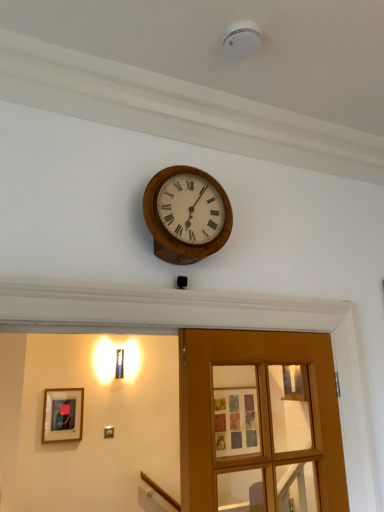
Locate an element on the screen. This screenshot has height=512, width=384. wooden wall clock at upper center is located at coordinates (186, 214).

What are the coordinates of `wooden glass door at center` in the screenshot? It's located at (258, 410).

Looking at this image, considering the relative positions of wooden framed picture at lower left and wooden wall clock at upper center in the image provided, is wooden framed picture at lower left to the left of wooden wall clock at upper center from the viewer's perspective?

Yes.

From a real-world perspective, which is physically above, wooden framed picture at lower left or wooden wall clock at upper center?

wooden wall clock at upper center, from a real-world perspective.

Is wooden framed picture at lower left in contact with wooden wall clock at upper center?

No, wooden framed picture at lower left is not beside wooden wall clock at upper center.

How many degrees apart are the facing directions of wooden framed picture at lower left and wooden wall clock at upper center?

The angular difference between wooden framed picture at lower left and wooden wall clock at upper center is 2.02 degrees.

Does point (218, 215) come closer to viewer compared to point (273, 490)?

No, it is behind (273, 490).

Identify the location of door located on the right of wooden wall clock at upper center. Image resolution: width=384 pixels, height=512 pixels. (258, 410).

From a real-world perspective, which is physically above, wooden wall clock at upper center or wooden glass door at center?

wooden wall clock at upper center is physically above.

Is wooden glass door at center smaller than wooden wall clock at upper center?

No.

Is wooden glass door at center inside or outside of wooden wall clock at upper center?

wooden glass door at center is outside wooden wall clock at upper center.

Is wooden glass door at center positioned with its back to wooden wall clock at upper center?

That's not correct — wooden glass door at center is not looking away from wooden wall clock at upper center.

Between wooden glass door at center and wooden wall clock at upper center, which one has smaller width?

wooden wall clock at upper center.

Is wooden wall clock at upper center positioned far away from wooden framed picture at lower left?

Yes, wooden wall clock at upper center is far from wooden framed picture at lower left.

Considering the relative sizes of wooden wall clock at upper center and wooden framed picture at lower left in the image provided, is wooden wall clock at upper center bigger than wooden framed picture at lower left?

Yes, wooden wall clock at upper center is bigger than wooden framed picture at lower left.

This screenshot has height=512, width=384. I want to click on picture frame located below the wooden wall clock at upper center (from the image's perspective), so click(x=62, y=415).

Considering the relative sizes of wooden wall clock at upper center and wooden framed picture at lower left in the image provided, is wooden wall clock at upper center thinner than wooden framed picture at lower left?

Answer: Incorrect, the width of wooden wall clock at upper center is not less than that of wooden framed picture at lower left.

Does point (313, 429) come behind point (58, 411)?

No, (313, 429) is closer to viewer.

In the scene shown: From a real-world perspective, is wooden glass door at center beneath wooden framed picture at lower left?

No, from a real-world perspective, wooden glass door at center is not beneath wooden framed picture at lower left.

Looking at their sizes, would you say wooden framed picture at lower left is wider or thinner than wooden glass door at center?

Considering their sizes, wooden framed picture at lower left looks slimmer than wooden glass door at center.

From a real-world perspective, which object rests below the other?

From a 3D spatial view, wooden framed picture at lower left is below.

Is wooden framed picture at lower left positioned beyond the bounds of wooden glass door at center?

Yes.

Is wooden framed picture at lower left in front of wooden glass door at center?

No.

The image size is (384, 512). Identify the location of wall clock that is above the wooden framed picture at lower left (from the image's perspective). (186, 214).

Image resolution: width=384 pixels, height=512 pixels. Find the location of `wall clock that is above the wooden glass door at center (from a real-world perspective)`. wall clock that is above the wooden glass door at center (from a real-world perspective) is located at coordinates (186, 214).

In the scene shown: Considering their positions, is wooden glass door at center positioned further to wooden wall clock at upper center than wooden framed picture at lower left?

wooden framed picture at lower left is further to wooden wall clock at upper center.

When comparing their distances from wooden framed picture at lower left, does wooden glass door at center or wooden wall clock at upper center seem closer?

wooden glass door at center.

Looking at the image, which one is located closer to wooden glass door at center, wooden framed picture at lower left or wooden wall clock at upper center?

wooden wall clock at upper center is positioned closer to the anchor wooden glass door at center.

Looking at the image, which one is located closer to wooden wall clock at upper center, wooden framed picture at lower left or wooden glass door at center?

The object closer to wooden wall clock at upper center is wooden glass door at center.

From the image, which object appears to be nearer to wooden framed picture at lower left, wooden wall clock at upper center or wooden glass door at center?

Among the two, wooden glass door at center is located nearer to wooden framed picture at lower left.

Which object lies further to the anchor point wooden glass door at center, wooden wall clock at upper center or wooden framed picture at lower left?

The object further to wooden glass door at center is wooden framed picture at lower left.

Find the location of a particular element. The image size is (384, 512). wall clock between wooden glass door at center and wooden framed picture at lower left in the front-back direction is located at coordinates (186, 214).